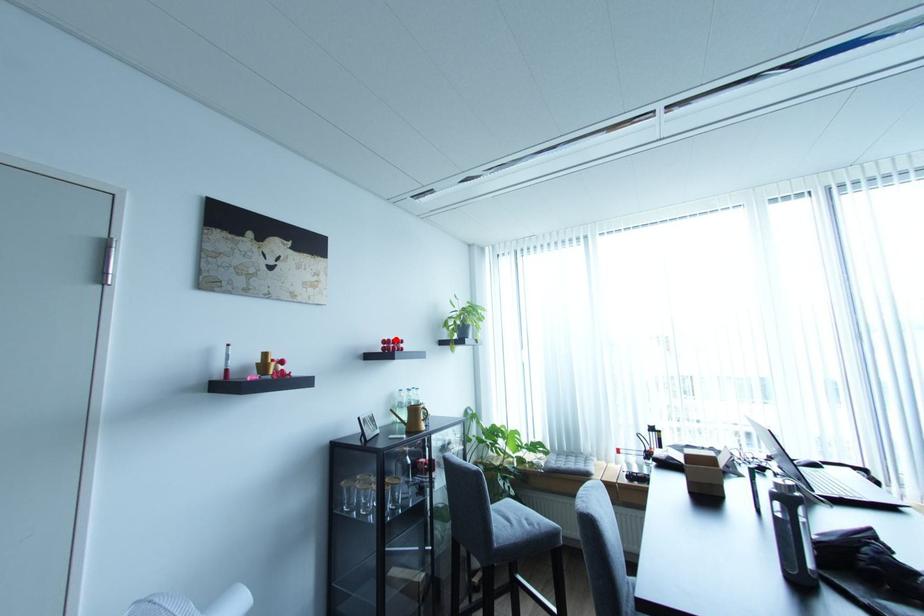
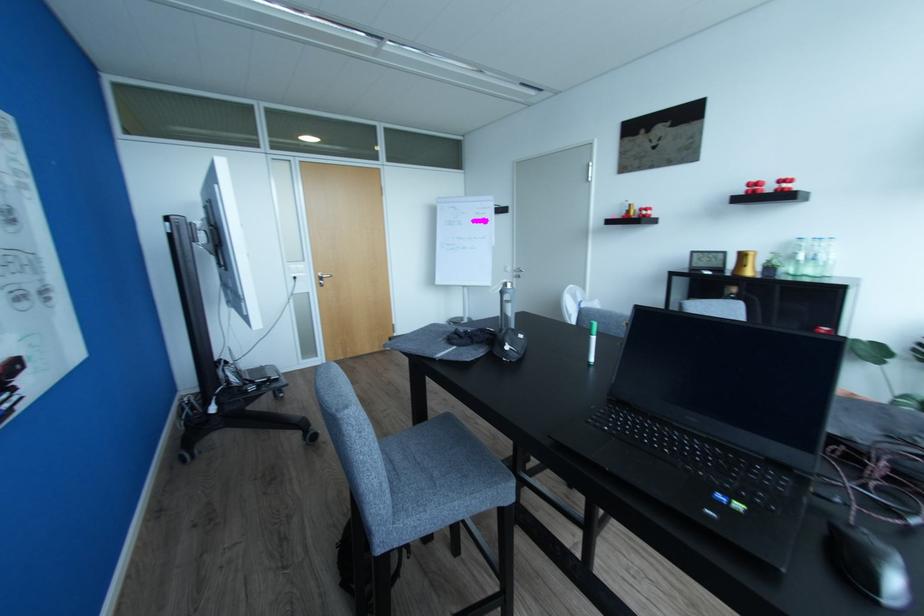
Where in the second image is the point corresponding to the highlighted location from the first image?

(760, 180)